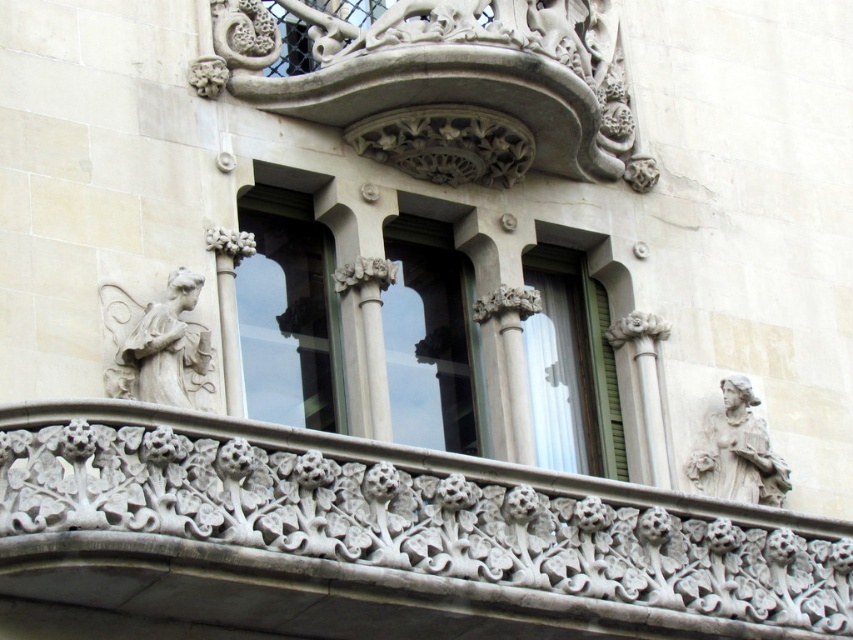
Question: Observing the image, what is the correct spatial positioning of transparent glass window at center in reference to clear glass window at center?

Choices:
 (A) left
 (B) right

Answer: (A)

Question: Is white stone carving at center smaller than white stone angel at upper left?

Choices:
 (A) no
 (B) yes

Answer: (A)

Question: Which point appears closest to the camera in this image?

Choices:
 (A) (90, 461)
 (B) (454, 380)
 (C) (592, 369)

Answer: (A)

Question: Which point is farther to the camera?

Choices:
 (A) (544, 394)
 (B) (422, 237)
 (C) (616, 605)

Answer: (B)

Question: Which point is farther to the camera?

Choices:
 (A) white stone carving at center
 (B) green matte window at center
 (C) white stone statue at upper left

Answer: (B)

Question: Considering the relative positions of green matte window at center and white stone statue at upper left in the image provided, where is green matte window at center located with respect to white stone statue at upper left?

Choices:
 (A) left
 (B) right

Answer: (A)